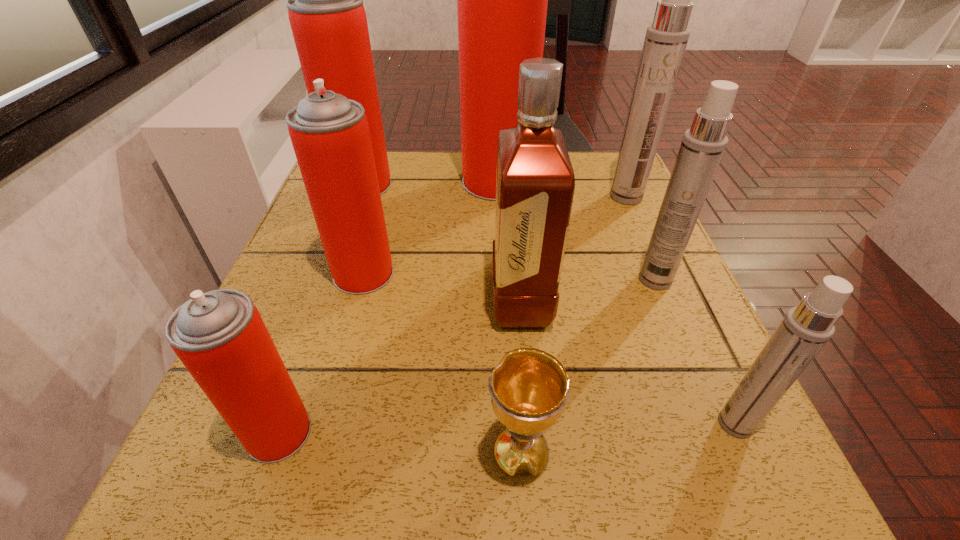
In the image, there is a desktop. Identify the location of free space at the right edge. This screenshot has height=540, width=960. (624, 212).

In the image, there is a desktop. Where is `vacant space at the far left corner`? vacant space at the far left corner is located at coordinates (390, 163).

Image resolution: width=960 pixels, height=540 pixels. In the image, there is a desktop. Find the location of `free space at the near left corner`. free space at the near left corner is located at coordinates (270, 504).

The height and width of the screenshot is (540, 960). In order to click on vacant area at the near right corner in this screenshot , I will do `click(716, 477)`.

Find the location of a particular element. The width and height of the screenshot is (960, 540). empty space between the third biggest red aerosol can and the smallest white aerosol can is located at coordinates (549, 349).

What are the coordinates of `empty space between the smallest red aerosol can and the shortest object` in the screenshot? It's located at (399, 444).

Identify the location of free space between the smallest red aerosol can and the second biggest red aerosol can. (321, 309).

This screenshot has width=960, height=540. Identify the location of free point between the liquor and the smallest white aerosol can. (628, 362).

You are a GUI agent. You are given a task and a screenshot of the screen. Output one action in this format:
    pyautogui.click(x=<x>, y=<y>)
    Task: Click on the free spot between the smallest red aerosol can and the second smallest white aerosol can
    
    Given the screenshot: What is the action you would take?
    pyautogui.click(x=468, y=356)

I want to click on vacant area that lies between the biggest white aerosol can and the gold chalice, so click(573, 326).